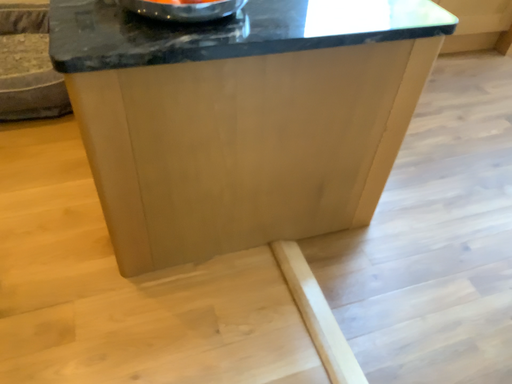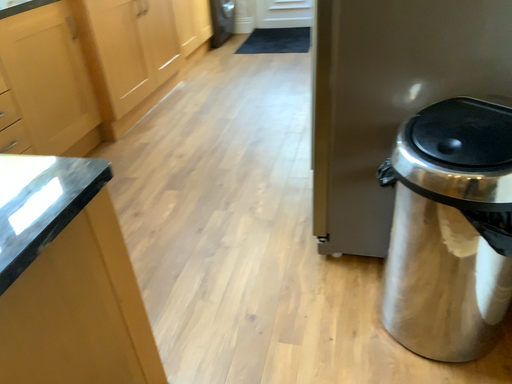
Question: Which way did the camera rotate in the video?

Choices:
 (A) rotated right
 (B) rotated left

Answer: (A)